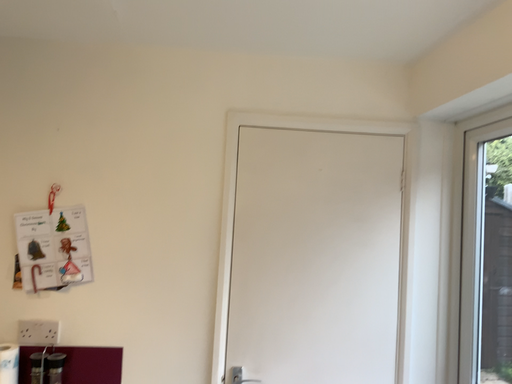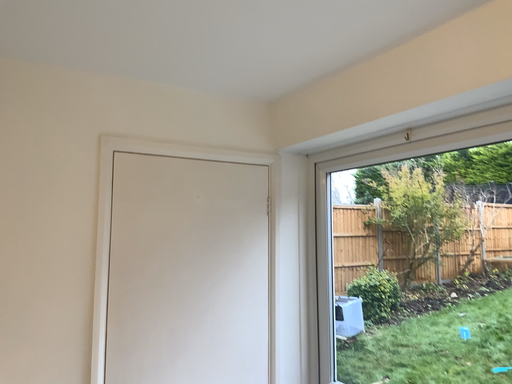
Question: Which way did the camera rotate in the video?

Choices:
 (A) rotated left
 (B) rotated right

Answer: (B)